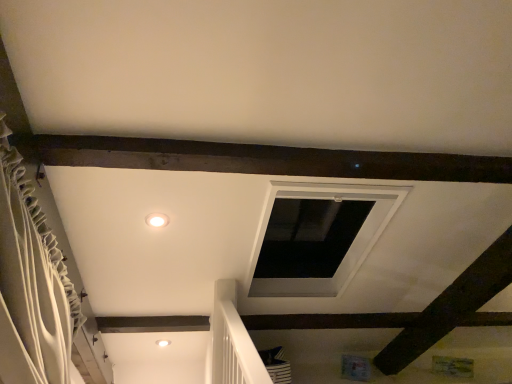
Question: Is matte white light fixture at center positioned with its back to white textured curtain at left?

Choices:
 (A) no
 (B) yes

Answer: (A)

Question: Can we say matte white light fixture at center lies outside white textured curtain at left?

Choices:
 (A) yes
 (B) no

Answer: (A)

Question: Is matte white light fixture at center in contact with white textured curtain at left?

Choices:
 (A) no
 (B) yes

Answer: (A)

Question: Considering the relative positions of matte white light fixture at center and white textured curtain at left in the image provided, is matte white light fixture at center behind white textured curtain at left?

Choices:
 (A) no
 (B) yes

Answer: (B)

Question: Considering the relative positions of matte white light fixture at center and white textured curtain at left in the image provided, is matte white light fixture at center to the right of white textured curtain at left from the viewer's perspective?

Choices:
 (A) yes
 (B) no

Answer: (A)

Question: Does matte white light fixture at center lie in front of white textured curtain at left?

Choices:
 (A) no
 (B) yes

Answer: (A)

Question: Does white textured curtain at left have a lesser height compared to matte white light fixture at center?

Choices:
 (A) yes
 (B) no

Answer: (B)

Question: Considering the relative sizes of white textured curtain at left and matte white light fixture at center in the image provided, is white textured curtain at left bigger than matte white light fixture at center?

Choices:
 (A) no
 (B) yes

Answer: (B)

Question: Is white textured curtain at left not near matte white light fixture at center?

Choices:
 (A) yes
 (B) no

Answer: (B)

Question: Considering the relative positions of white textured curtain at left and matte white light fixture at center in the image provided, is white textured curtain at left to the left of matte white light fixture at center from the viewer's perspective?

Choices:
 (A) no
 (B) yes

Answer: (B)

Question: Is matte white light fixture at center surrounded by white textured curtain at left?

Choices:
 (A) yes
 (B) no

Answer: (B)

Question: From the image's perspective, does white textured curtain at left appear higher than matte white light fixture at center?

Choices:
 (A) yes
 (B) no

Answer: (B)

Question: From a real-world perspective, relative to white textured curtain at left, is matte white light fixture at center vertically above or below?

Choices:
 (A) below
 (B) above

Answer: (B)